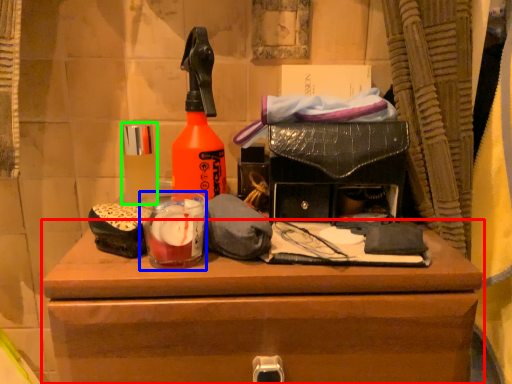
Question: Which object is the closest to the chest of drawers (highlighted by a red box)? Choose among these: beverage (highlighted by a blue box) or toiletry (highlighted by a green box).

Choices:
 (A) beverage
 (B) toiletry

Answer: (A)